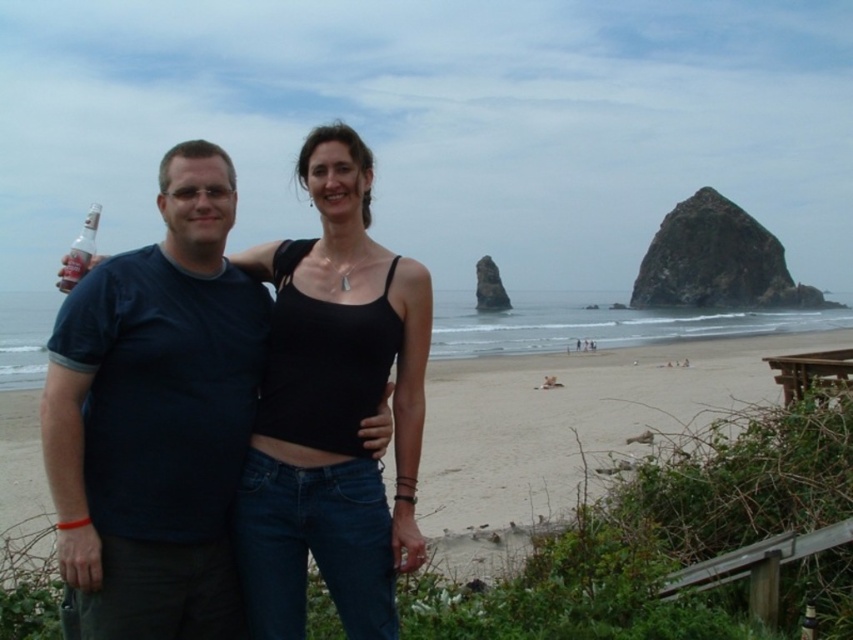
You are standing at the point marked as point (x=155, y=419). Which object are you on?

You are on the dark blue T shirt at left.